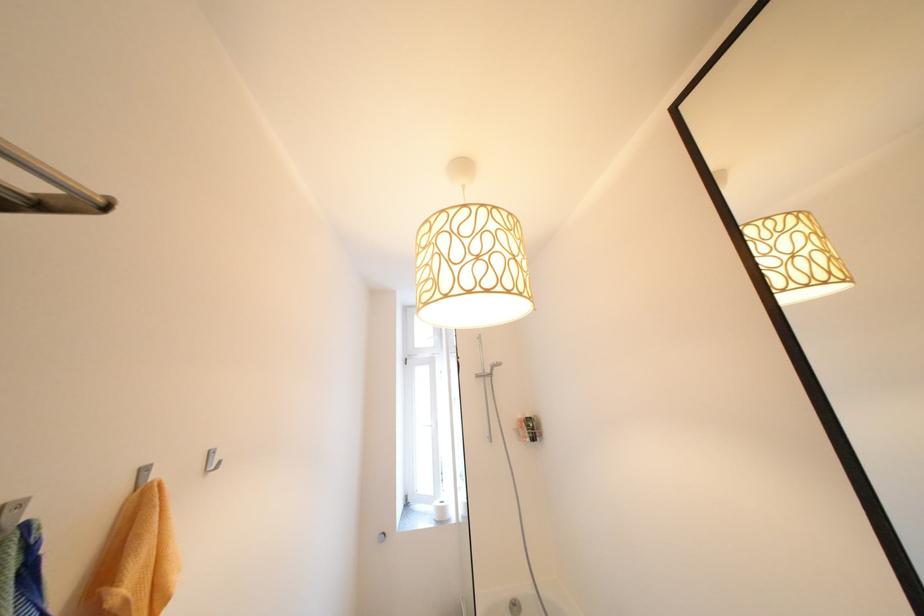
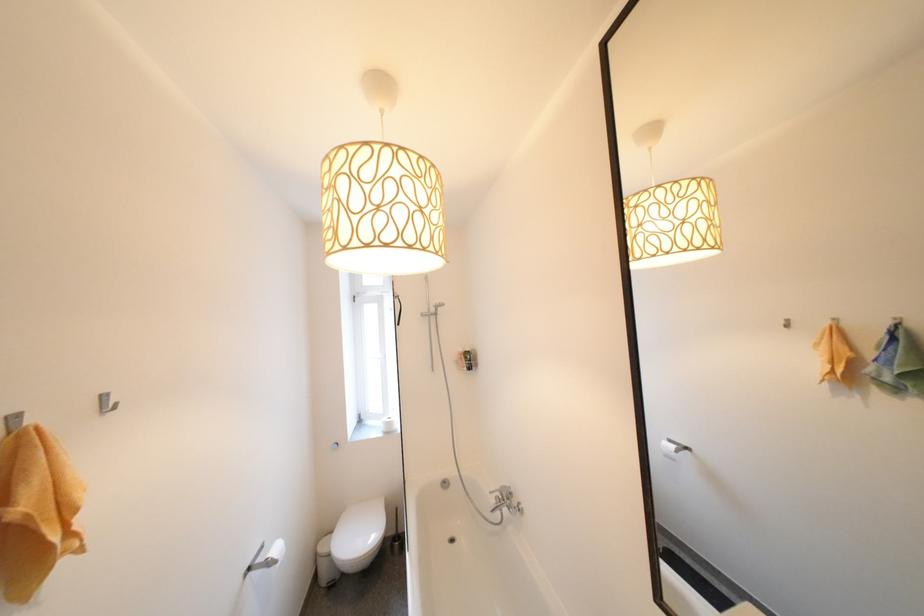
Question: The images are taken continuously from a first-person perspective. In which direction are you moving?

Choices:
 (A) Left
 (B) Right
 (C) Forward
 (D) Backward

Answer: (B)